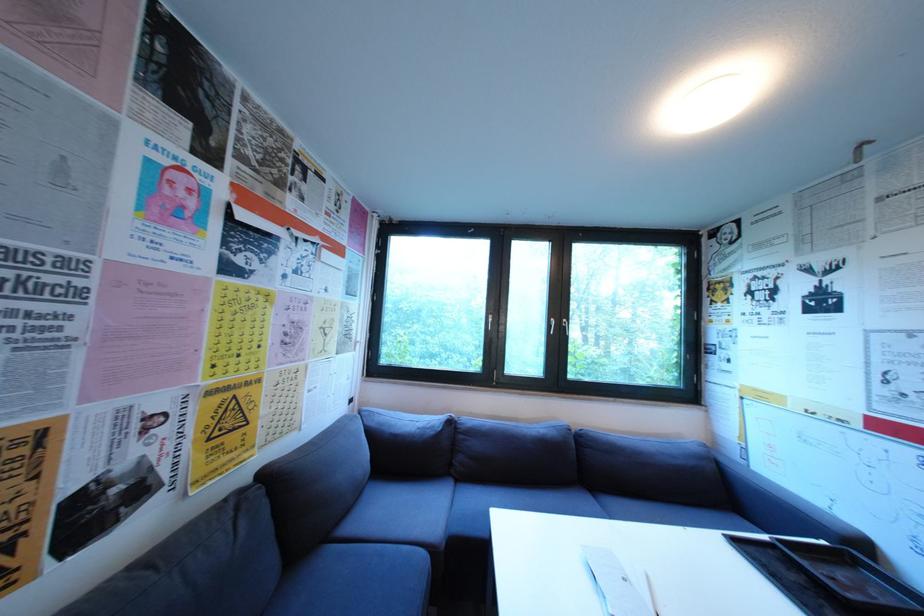
This screenshot has width=924, height=616. What do you see at coordinates (406, 509) in the screenshot?
I see `the blue sofa sitting surface` at bounding box center [406, 509].